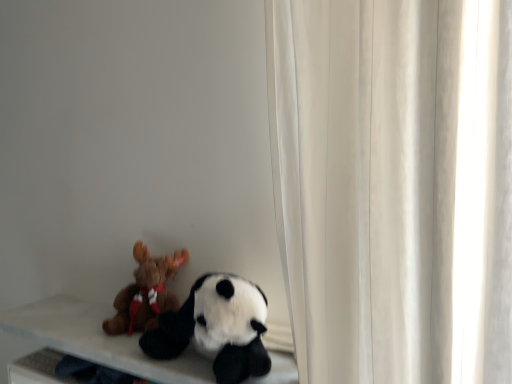
Question: Would you say brown plush moose at left, arranged as the 1th toy when viewed from the left, is inside or outside soft white table at lower left?

Choices:
 (A) inside
 (B) outside

Answer: (B)

Question: Considering the positions of brown plush moose at left, arranged as the 1th toy when viewed from the left, and soft white table at lower left in the image, is brown plush moose at left, arranged as the 1th toy when viewed from the left, taller or shorter than soft white table at lower left?

Choices:
 (A) tall
 (B) short

Answer: (A)

Question: Estimate the real-world distances between objects in this image. Which object is closer to the brown plush moose at left, the 2th toy when ordered from right to left?

Choices:
 (A) soft white table at lower left
 (B) soft plush panda at lower left, arranged as the first toy when viewed from the right

Answer: (A)

Question: Which object is positioned farthest from the brown plush moose at left, the 2th toy when ordered from right to left?

Choices:
 (A) soft white table at lower left
 (B) soft plush panda at lower left, placed as the 2th toy when sorted from left to right

Answer: (B)